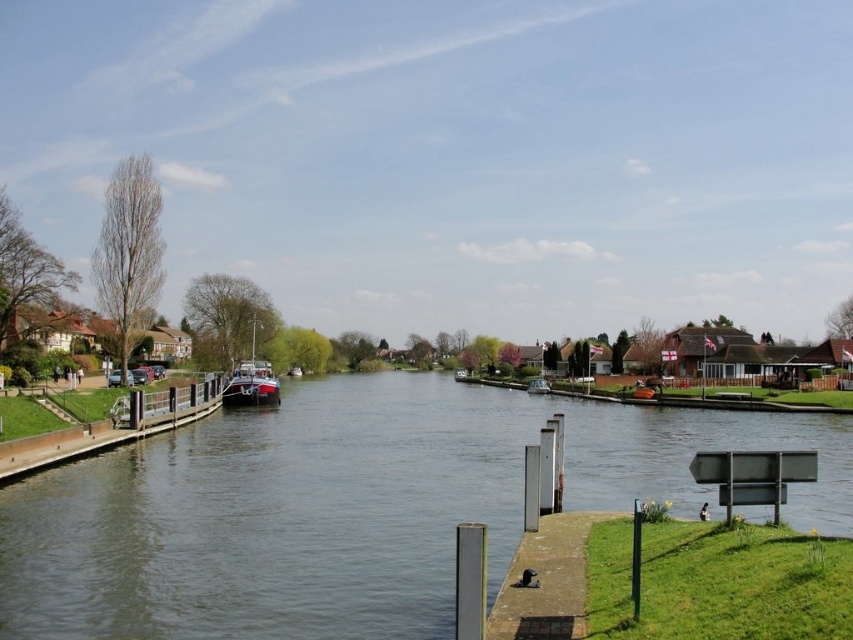
Question: Does red polished wood boat at center-left appear on the right side of matte black boat at center?

Choices:
 (A) yes
 (B) no

Answer: (B)

Question: Estimate the real-world distances between objects in this image. Which object is farther from the smooth concrete dock at left?

Choices:
 (A) red polished wood boat at center-left
 (B) matte black boat at center

Answer: (B)

Question: Does smooth concrete dock at left have a greater width compared to matte black boat at center?

Choices:
 (A) yes
 (B) no

Answer: (B)

Question: Among these objects, which one is nearest to the camera?

Choices:
 (A) matte black boat at center
 (B) clear water at center
 (C) red polished wood boat at center-left
 (D) smooth concrete dock at left

Answer: (B)

Question: Which object is closer to the camera taking this photo?

Choices:
 (A) red polished wood boat at center-left
 (B) clear water at center
 (C) smooth concrete dock at left

Answer: (B)

Question: Is the position of clear water at center less distant than that of red polished wood boat at center-left?

Choices:
 (A) yes
 (B) no

Answer: (A)